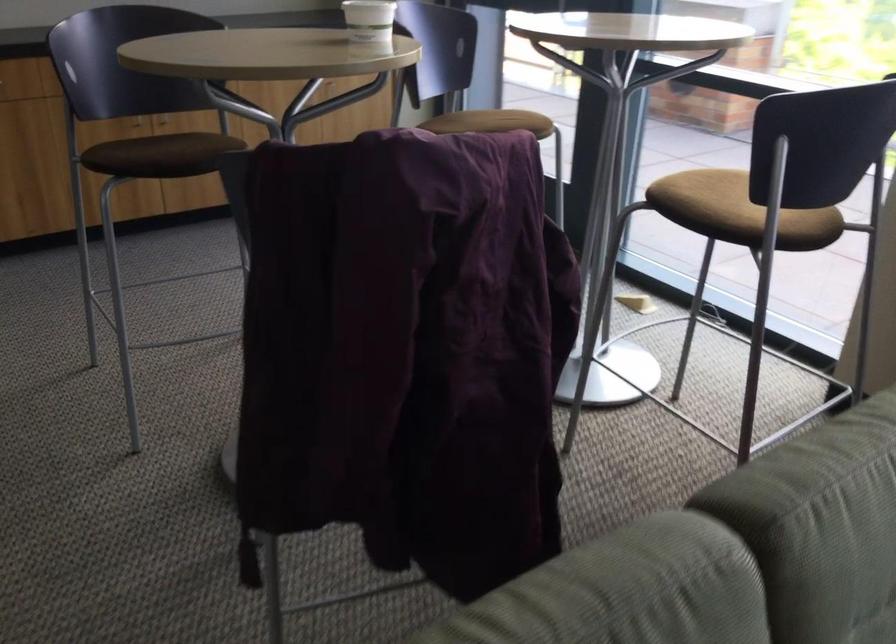
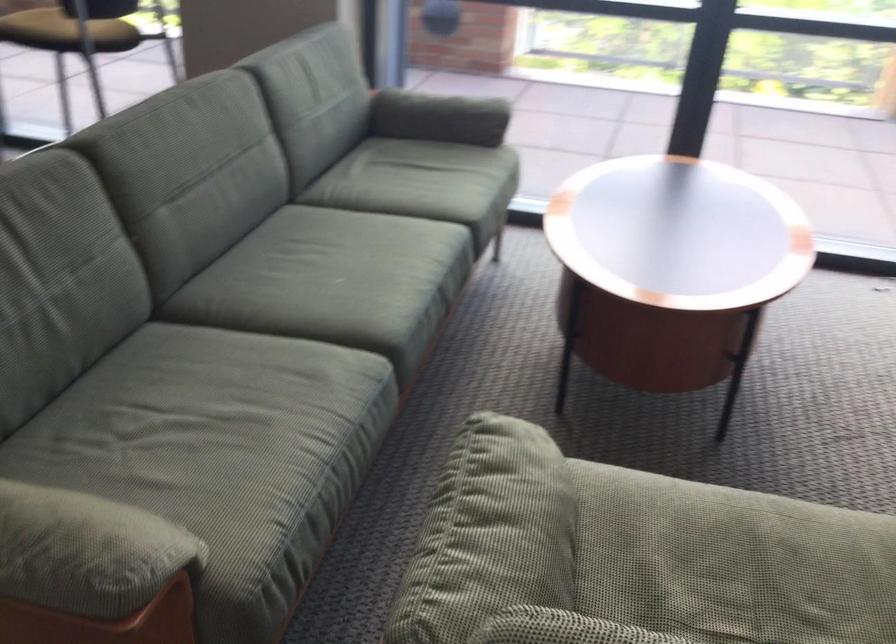
Question: Based on the continuous images, in which direction is the camera rotating? Reply with the corresponding letter.

Choices:
 (A) Left
 (B) Right
 (C) Up
 (D) Down

Answer: (B)